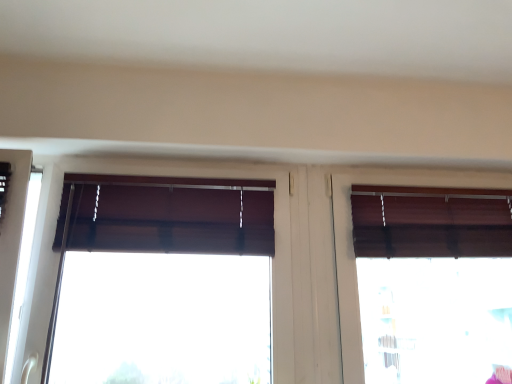
Question: In terms of height, does brown fabric window at center, which is the 2th window in right-to-left order, look taller or shorter compared to brown wooden blinds at right, which is the second window in left-to-right order?

Choices:
 (A) short
 (B) tall

Answer: (A)

Question: From a real-world perspective, is brown fabric window at center, which is the 2th window in right-to-left order, positioned above or below brown wooden blinds at right, which is the 1th window from right to left?

Choices:
 (A) below
 (B) above

Answer: (B)

Question: Is point (180, 198) closer or farther from the camera than point (374, 203)?

Choices:
 (A) closer
 (B) farther

Answer: (A)

Question: Considering the positions of brown wooden blinds at right, which is the second window in left-to-right order, and brown fabric window at center, which is the 2th window in right-to-left order, in the image, is brown wooden blinds at right, which is the second window in left-to-right order, taller or shorter than brown fabric window at center, which is the 2th window in right-to-left order,?

Choices:
 (A) short
 (B) tall

Answer: (B)

Question: Would you say brown wooden blinds at right, which is the second window in left-to-right order, is to the left or to the right of brown fabric window at center, which is the 2th window in right-to-left order, in the picture?

Choices:
 (A) right
 (B) left

Answer: (A)

Question: Relative to brown fabric window at center, which is the 2th window in right-to-left order, is brown wooden blinds at right, which is the 1th window from right to left, in front or behind?

Choices:
 (A) behind
 (B) front

Answer: (A)

Question: Do you think brown wooden blinds at right, which is the 1th window from right to left, is within brown fabric window at center, which is the 2th window in right-to-left order, or outside of it?

Choices:
 (A) outside
 (B) inside

Answer: (A)